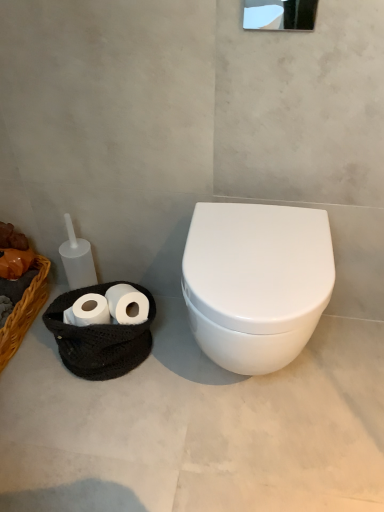
The image size is (384, 512). Identify the location of spots to the right of white matte toilet paper at lower left. (175, 353).